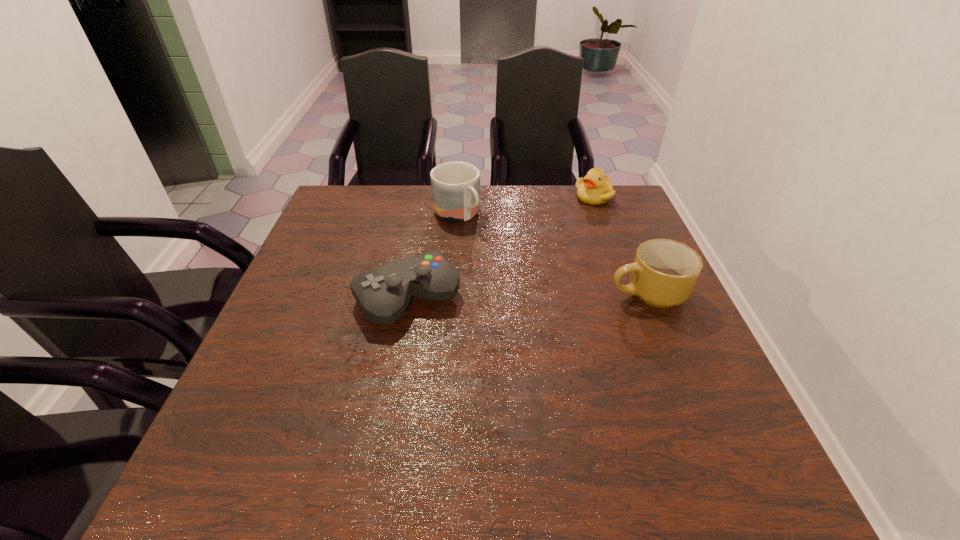
Image resolution: width=960 pixels, height=540 pixels. Identify the location of free space that satisfies the following two spatial constraints: 1. on the front side of the shorter mug; 2. on the side with the handle of the duckling. (630, 293).